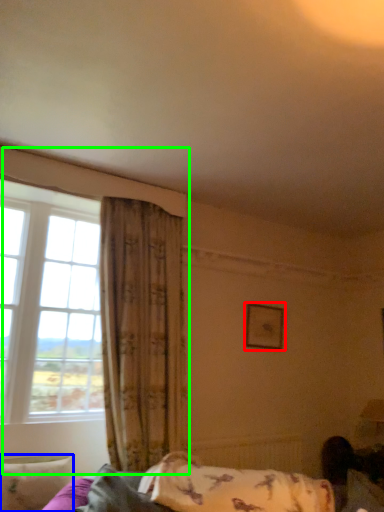
Question: Considering the real-world distances, which object is closest to picture frame (highlighted by a red box)? pillow (highlighted by a blue box) or window (highlighted by a green box).

Choices:
 (A) pillow
 (B) window

Answer: (B)